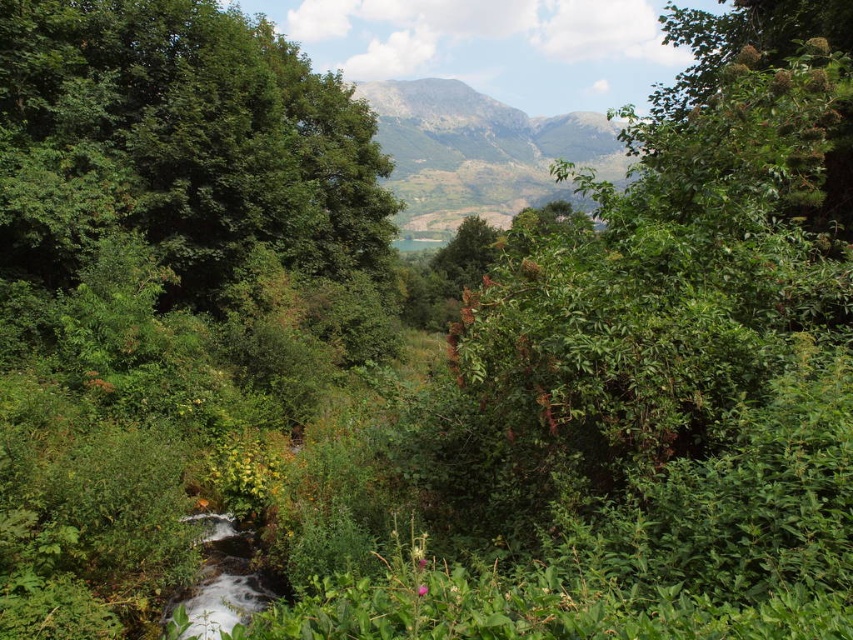
How much distance is there between green leafy tree at upper left and gray rocky mountain at center?

62.95 meters

Who is lower down, green leafy tree at upper left or gray rocky mountain at center?

green leafy tree at upper left is below.

Locate an element on the screen. green leafy tree at upper left is located at coordinates (178, 145).